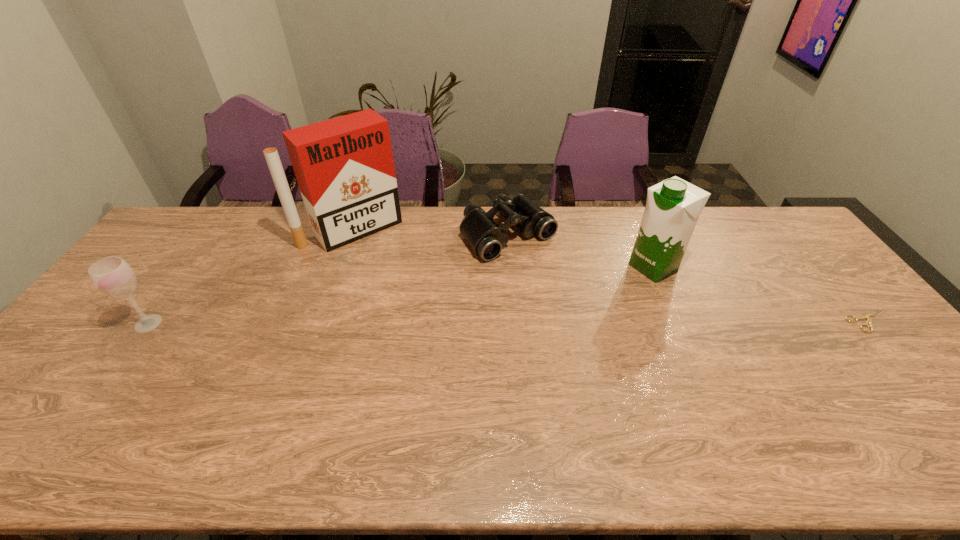
This screenshot has width=960, height=540. Identify the location of free space on the desktop that is between the leftmost object and the shears and is positioned on the front-facing side of the third object from left to right. (596, 322).

I want to click on vacant space on the desktop that is between the third shortest object and the shears and is positioned on the front-facing side of the soya milk, so click(559, 322).

Locate an element on the screen. This screenshot has height=540, width=960. vacant space on the desktop that is between the third tallest object and the rightmost object and is positioned on the front-facing side of the second object from left to right is located at coordinates (436, 322).